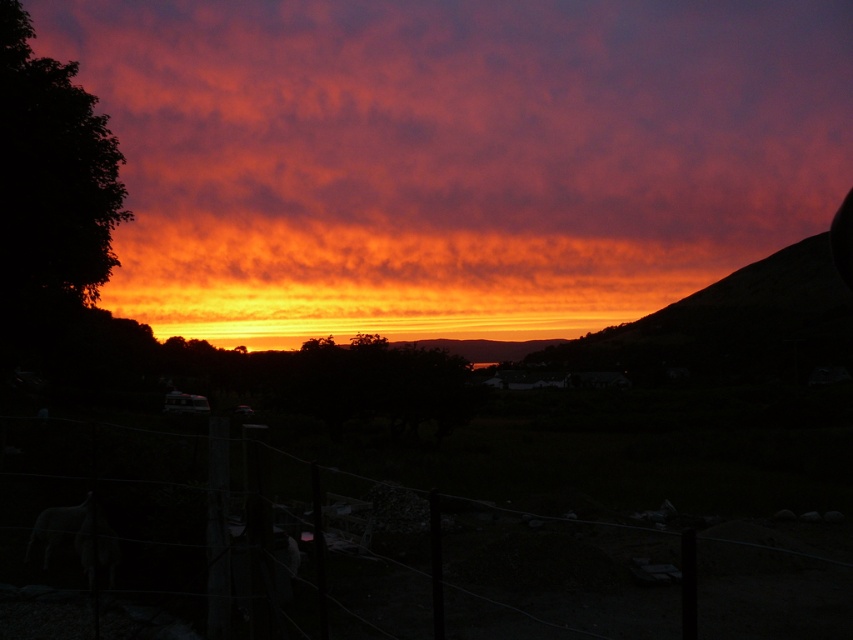
Is cloudy orange sky at upper center bigger than wire mesh fence at lower center?

Correct, cloudy orange sky at upper center is larger in size than wire mesh fence at lower center.

Who is more forward, [537,246] or [161,509]?

Point [161,509] is more forward.

This screenshot has width=853, height=640. What do you see at coordinates (453, 157) in the screenshot?
I see `cloudy orange sky at upper center` at bounding box center [453, 157].

Where is `cloudy orange sky at upper center`? Image resolution: width=853 pixels, height=640 pixels. cloudy orange sky at upper center is located at coordinates (453, 157).